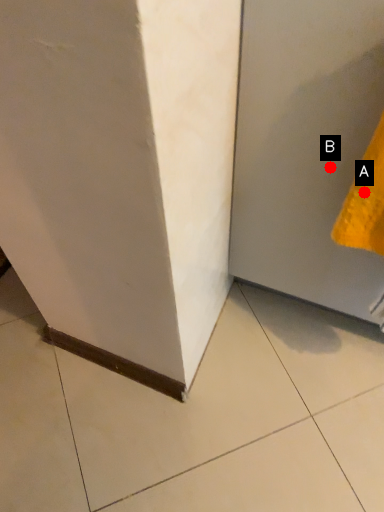
Question: Two points are circled on the image, labeled by A and B beside each circle. Which point is farther to the camera?

Choices:
 (A) A is further
 (B) B is further

Answer: (B)